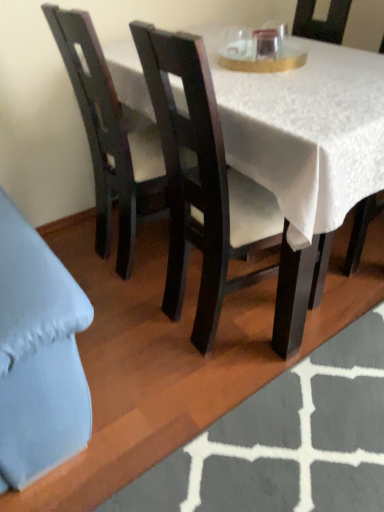
In order to click on vacant space behind white textured rug at lower center in this screenshot , I will do `click(235, 308)`.